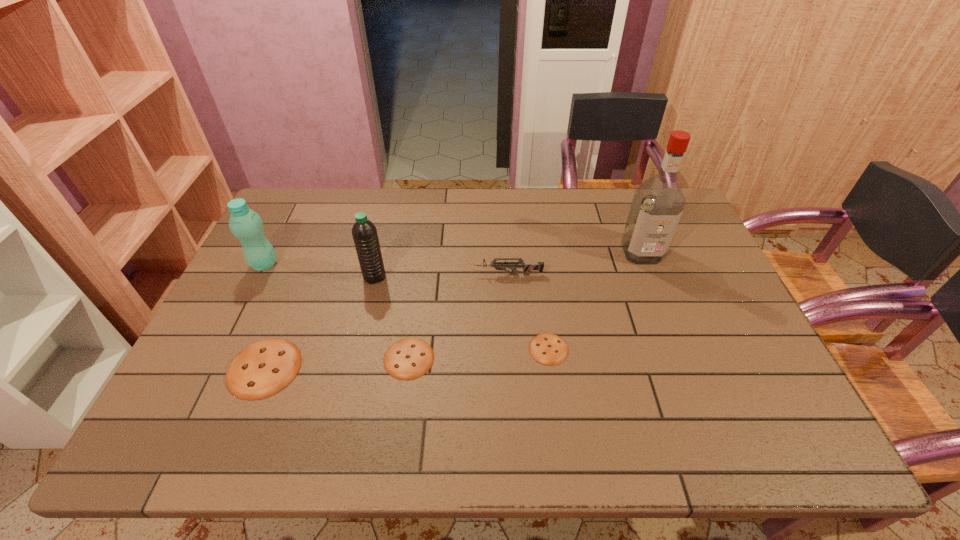
Identify the location of free point that keeps the cookies evenly spaced on the right. The width and height of the screenshot is (960, 540). (684, 340).